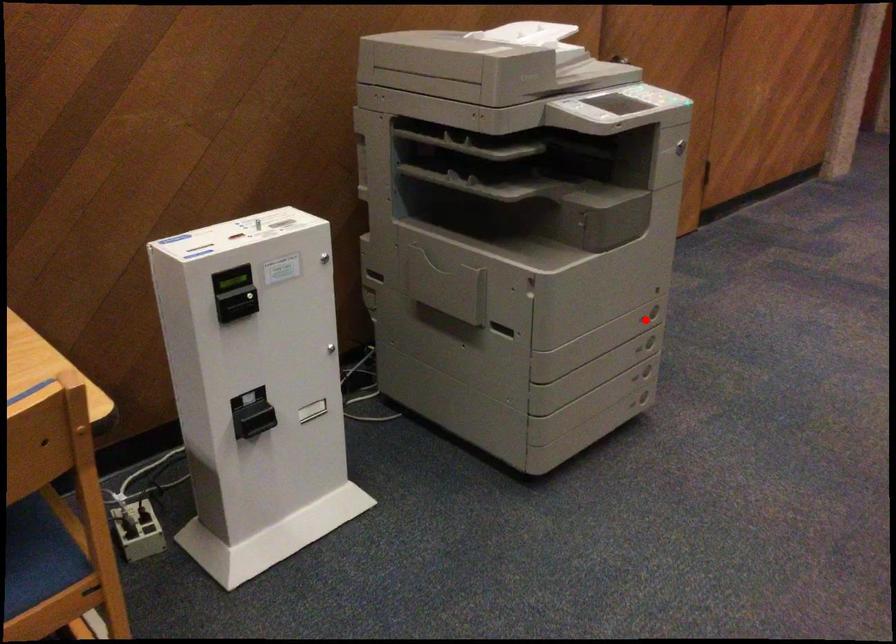
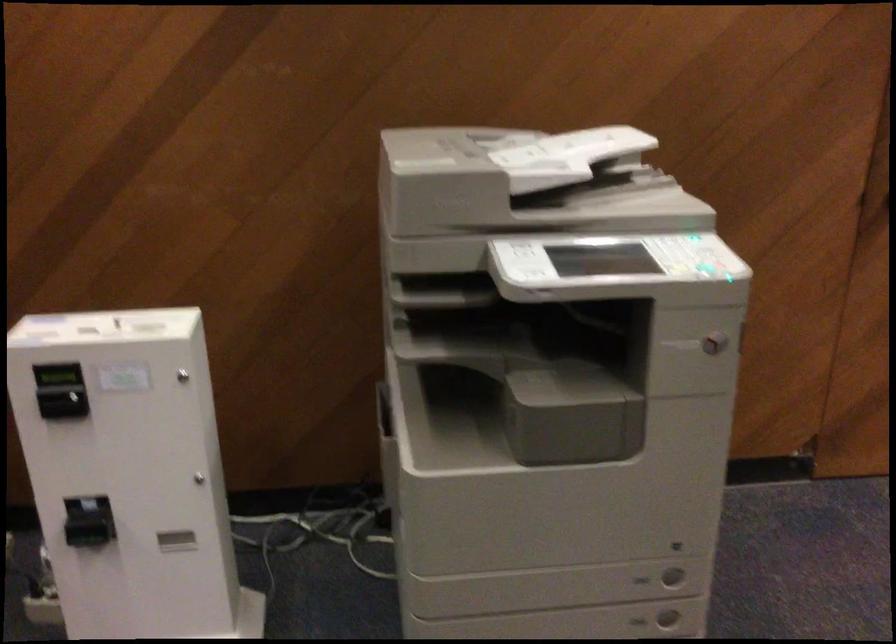
Question: I am providing you with two images of the same scene from different viewpoints. Image1 has a red point marked. In image2, the corresponding 3D location appears at what relative position? Reply with the corresponding letter.

Choices:
 (A) Closer
 (B) Farther

Answer: (A)